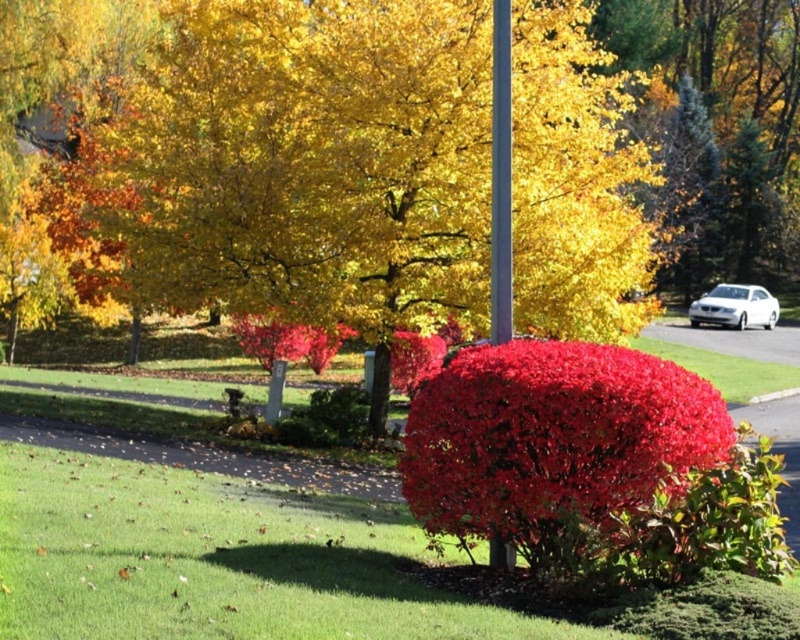
You are standing in the autumn scene and want to take a photo of the shiny red bush at center. If your camera has a maximum focus range of 7 meters, will it be able to focus on the bush?

The shiny red bush at center is 7.22 meters away from the camera. Since the maximum focus range is 7 meters, the camera cannot focus on the bush because it is slightly out of range.

Consider the image. You are driving a white glossy sedan at right and want to park it near the metallic silver pole at center. Can you safely maneuver the car to the left side of the pole without hitting it?

The metallic silver pole at center is to the left of the white glossy sedan at right, so the sedan is already positioned to the right of the pole. To park it near the pole on the left side, you can safely move the white glossy sedan at right towards the left without hitting the pole as there is space between them.

You are standing in the autumn scene and want to walk from the point closer to you to the farther point. Which path would you take between the two points, point (620, 385) and point (501, 113)?

The path from point (620, 385) to point (501, 113) would involve moving towards the background since point (620, 385) is closer to the viewer and point (501, 113) is farther away.